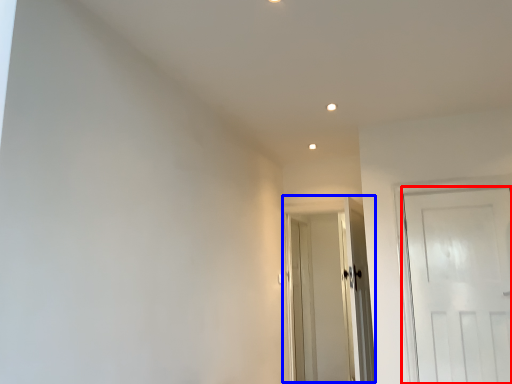
Question: Which object appears closest to the camera in this image, door (highlighted by a red box) or door (highlighted by a blue box)?

Choices:
 (A) door
 (B) door

Answer: (A)